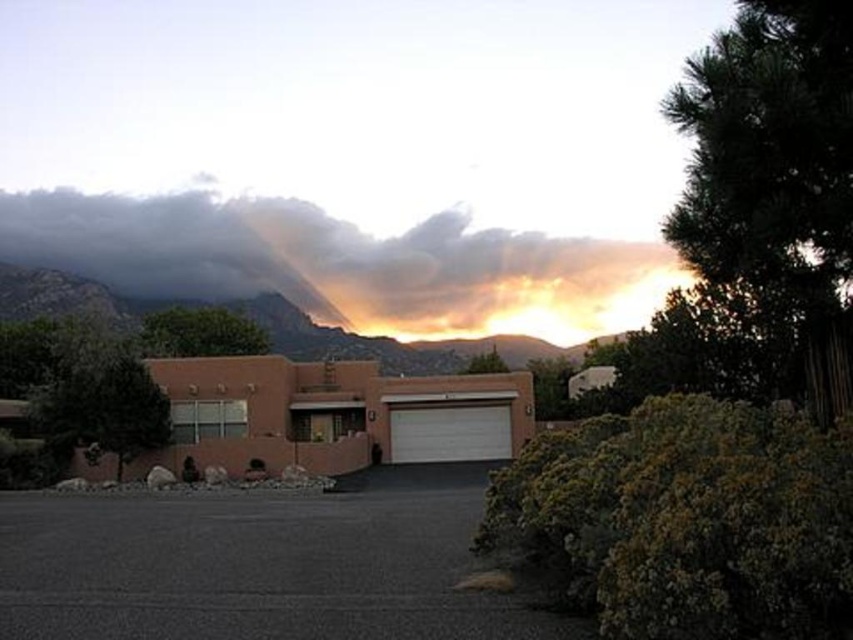
Question: Which point is farther to the camera?

Choices:
 (A) rugged stone mountain at upper center
 (B) dark gray cloud at upper center
 (C) dark asphalt driveway at center

Answer: (B)

Question: Estimate the real-world distances between objects in this image. Which object is farther from the dark asphalt driveway at center?

Choices:
 (A) rugged stone mountain at upper center
 (B) white matte garage door at center
 (C) dark gray cloud at upper center

Answer: (C)

Question: Can you confirm if dark gray cloud at upper center is positioned to the left of rugged stone mountain at upper center?

Choices:
 (A) no
 (B) yes

Answer: (A)

Question: Estimate the real-world distances between objects in this image. Which object is farther from the dark gray cloud at upper center?

Choices:
 (A) dark asphalt driveway at center
 (B) white matte garage door at center

Answer: (A)

Question: Is dark asphalt driveway at center wider than rugged stone mountain at upper center?

Choices:
 (A) yes
 (B) no

Answer: (B)

Question: Can you confirm if rugged stone mountain at upper center is positioned to the left of white matte garage door at center?

Choices:
 (A) yes
 (B) no

Answer: (A)